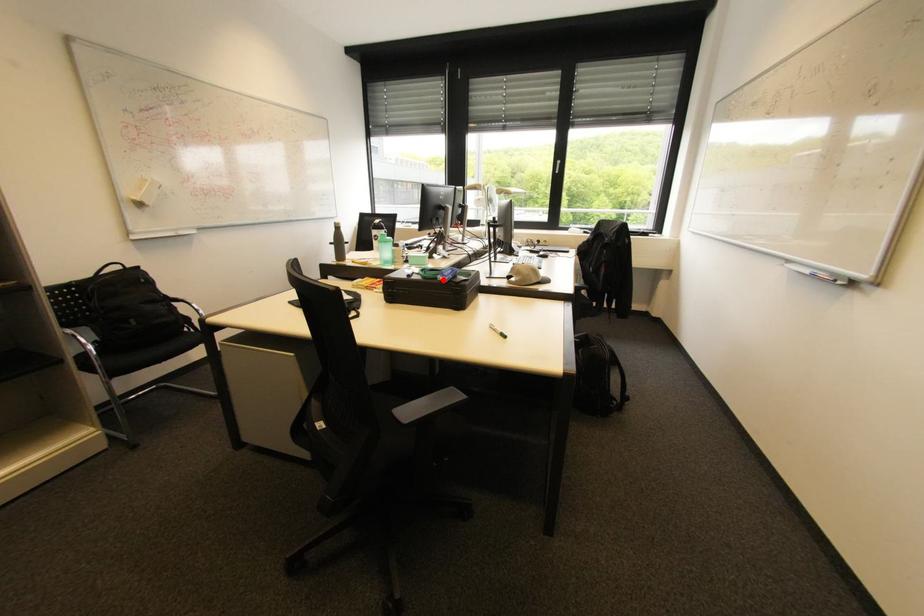
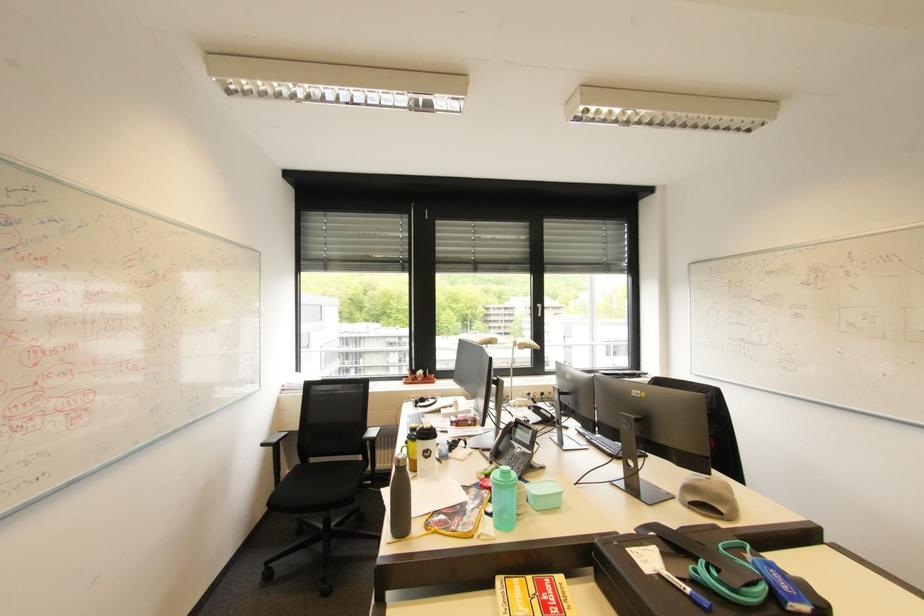
In the second image, find the point that corresponds to the highlighted location in the first image.

(795, 610)